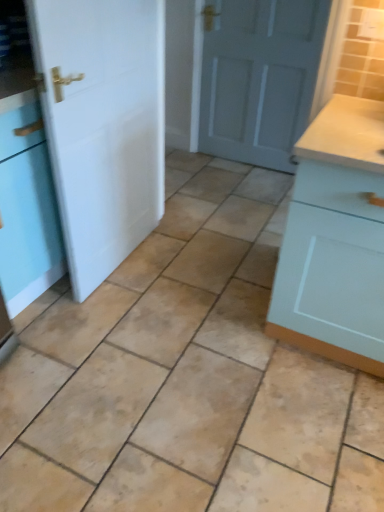
What do you see at coordinates (335, 240) in the screenshot?
I see `light blue wood cabinet at right` at bounding box center [335, 240].

What do you see at coordinates (259, 77) in the screenshot? Image resolution: width=384 pixels, height=512 pixels. I see `matte gray door at center, marked as the 2th door in a left-to-right arrangement` at bounding box center [259, 77].

Locate an element on the screen. The width and height of the screenshot is (384, 512). white matte door at left, acting as the second door starting from the back is located at coordinates (102, 125).

From the image's perspective, between beige ceramic tile at center and matte gray door at center, marked as the 2th door in a left-to-right arrangement, who is located below?

beige ceramic tile at center is shown below in the image.

Who is smaller, beige ceramic tile at center or matte gray door at center, the second door viewed from the front?

Smaller between the two is matte gray door at center, the second door viewed from the front.

The image size is (384, 512). I want to click on ceramic tile located on the left of matte gray door at center, marked as the 2th door in a left-to-right arrangement, so click(186, 375).

Can you tell me how much beige ceramic tile at center and matte gray door at center, the second door viewed from the front, differ in facing direction?

The facing directions of beige ceramic tile at center and matte gray door at center, the second door viewed from the front, are 90 degrees apart.

Which of these two, matte gray door at center, which appears as the first door when viewed from the back, or light blue wood cabinet at right, is smaller?

Smaller between the two is matte gray door at center, which appears as the first door when viewed from the back.

Measure the distance from matte gray door at center, which appears as the first door when viewed from the back, to light blue wood cabinet at right.

A distance of 4.97 feet exists between matte gray door at center, which appears as the first door when viewed from the back, and light blue wood cabinet at right.

Can you confirm if matte gray door at center, placed as the 1th door when sorted from right to left, is positioned to the right of light blue wood cabinet at right?

No, matte gray door at center, placed as the 1th door when sorted from right to left, is not to the right of light blue wood cabinet at right.

Which is in front, point (240, 67) or point (287, 311)?

Point (287, 311)

Looking at this image, considering the sizes of objects light blue wood cabinet at right and white matte door at left, which ranks as the 1th door in front-to-back order, in the image provided, who is taller, light blue wood cabinet at right or white matte door at left, which ranks as the 1th door in front-to-back order,?

white matte door at left, which ranks as the 1th door in front-to-back order, is taller.

Considering the relative positions of light blue wood cabinet at right and white matte door at left, which ranks as the 1th door in front-to-back order, in the image provided, is light blue wood cabinet at right to the left or to the right of white matte door at left, which ranks as the 1th door in front-to-back order,?

Clearly, light blue wood cabinet at right is on the right of white matte door at left, which ranks as the 1th door in front-to-back order, in the image.

The image size is (384, 512). I want to click on door that is the 1st one when counting backward from the light blue wood cabinet at right, so point(102,125).

From the image's perspective, is light blue wood cabinet at right located above or below white matte door at left, arranged as the first door when viewed from the left?

light blue wood cabinet at right is below white matte door at left, arranged as the first door when viewed from the left.

Does light blue wood cabinet at right touch matte gray door at center, the second door viewed from the front?

No, light blue wood cabinet at right is not with matte gray door at center, the second door viewed from the front.

Considering the sizes of objects light blue wood cabinet at right and matte gray door at center, placed as the 1th door when sorted from right to left, in the image provided, who is wider, light blue wood cabinet at right or matte gray door at center, placed as the 1th door when sorted from right to left,?

With larger width is light blue wood cabinet at right.

Can you confirm if light blue wood cabinet at right is positioned to the left of matte gray door at center, which appears as the first door when viewed from the back?

No, light blue wood cabinet at right is not to the left of matte gray door at center, which appears as the first door when viewed from the back.

Is light blue wood cabinet at right smaller than matte gray door at center, which appears as the first door when viewed from the back?

No, light blue wood cabinet at right is not smaller than matte gray door at center, which appears as the first door when viewed from the back.

Does matte gray door at center, the second door viewed from the front, come behind white matte door at left, which ranks as the second door in right-to-left order?

Yes, matte gray door at center, the second door viewed from the front, is further from the camera.

In the image, there is a matte gray door at center, the second door viewed from the front. At what (x,y) coordinates should I click in order to perform the action: click on door below it (from the image's perspective). Please return your answer as a coordinate pair (x, y). The image size is (384, 512). Looking at the image, I should click on (102, 125).

Choose the correct answer: Is matte gray door at center, placed as the 1th door when sorted from right to left, inside white matte door at left, which ranks as the second door in right-to-left order, or outside it?

matte gray door at center, placed as the 1th door when sorted from right to left, cannot be found inside white matte door at left, which ranks as the second door in right-to-left order.

Between point (222, 4) and point (77, 93), which one is positioned in front?

Point (77, 93)

In order to click on door that is the 1st one when counting upward from the beige ceramic tile at center (from the image's perspective) in this screenshot , I will do `click(102, 125)`.

From the image's perspective, is beige ceramic tile at center beneath white matte door at left, acting as the second door starting from the back?

Yes, from the image's perspective, beige ceramic tile at center is beneath white matte door at left, acting as the second door starting from the back.

Which is more to the left, beige ceramic tile at center or white matte door at left, which ranks as the second door in right-to-left order?

From the viewer's perspective, white matte door at left, which ranks as the second door in right-to-left order, appears more on the left side.

Is beige ceramic tile at center taller than white matte door at left, acting as the second door starting from the back?

No.

Is white matte door at left, which ranks as the 1th door in front-to-back order, turned away from beige ceramic tile at center?

No, white matte door at left, which ranks as the 1th door in front-to-back order, is not facing the opposite direction of beige ceramic tile at center.

How many degrees apart are the facing directions of white matte door at left, which ranks as the 1th door in front-to-back order, and beige ceramic tile at center?

179 degrees separate the facing orientations of white matte door at left, which ranks as the 1th door in front-to-back order, and beige ceramic tile at center.

From a real-world perspective, which object rests below the other?

beige ceramic tile at center is physically lower.

Considering the points (65, 14) and (365, 490), which point is in front, point (65, 14) or point (365, 490)?

The point (65, 14) is closer.

What are the coordinates of `the 2nd door behind when counting from the beige ceramic tile at center` in the screenshot? It's located at (259, 77).

Locate an element on the screen. cabinetry below the matte gray door at center, placed as the 1th door when sorted from right to left (from a real-world perspective) is located at coordinates (335, 240).

Estimate the real-world distances between objects in this image. Which object is further from matte gray door at center, which appears as the first door when viewed from the back, beige ceramic tile at center or white matte door at left, arranged as the first door when viewed from the left?

beige ceramic tile at center lies further to matte gray door at center, which appears as the first door when viewed from the back, than the other object.

Based on their spatial positions, is beige ceramic tile at center or matte gray door at center, the second door viewed from the front, closer to light blue wood cabinet at right?

beige ceramic tile at center is positioned closer to the anchor light blue wood cabinet at right.

Which object lies further to the anchor point white matte door at left, which ranks as the second door in right-to-left order, matte gray door at center, marked as the 2th door in a left-to-right arrangement, or beige ceramic tile at center?

Among the two, matte gray door at center, marked as the 2th door in a left-to-right arrangement, is located further to white matte door at left, which ranks as the second door in right-to-left order.

Estimate the real-world distances between objects in this image. Which object is further from beige ceramic tile at center, white matte door at left, acting as the second door starting from the back, or light blue wood cabinet at right?

Among the two, white matte door at left, acting as the second door starting from the back, is located further to beige ceramic tile at center.

Based on their spatial positions, is beige ceramic tile at center or white matte door at left, which ranks as the second door in right-to-left order, further from light blue wood cabinet at right?

white matte door at left, which ranks as the second door in right-to-left order, is further to light blue wood cabinet at right.

When comparing their distances from light blue wood cabinet at right, does matte gray door at center, the second door viewed from the front, or beige ceramic tile at center seem closer?

beige ceramic tile at center is closer to light blue wood cabinet at right.

From the image, which object appears to be farther from matte gray door at center, the second door viewed from the front, white matte door at left, which ranks as the second door in right-to-left order, or light blue wood cabinet at right?

Among the two, light blue wood cabinet at right is located further to matte gray door at center, the second door viewed from the front.

Which object lies nearer to the anchor point light blue wood cabinet at right, white matte door at left, arranged as the first door when viewed from the left, or matte gray door at center, which appears as the first door when viewed from the back?

white matte door at left, arranged as the first door when viewed from the left, is closer to light blue wood cabinet at right.

Find the location of a particular element. The image size is (384, 512). cabinetry between beige ceramic tile at center and matte gray door at center, the second door viewed from the front, in the front-back direction is located at coordinates (335, 240).

Identify the location of door between beige ceramic tile at center and matte gray door at center, the second door viewed from the front, along the z-axis. This screenshot has height=512, width=384. (102, 125).

You are a GUI agent. You are given a task and a screenshot of the screen. Output one action in this format:
    pyautogui.click(x=<x>, y=<y>)
    Task: Click on the door located between light blue wood cabinet at right and matte gray door at center, the second door viewed from the front, in the depth direction
    This screenshot has height=512, width=384.
    Given the screenshot: What is the action you would take?
    pyautogui.click(x=102, y=125)

Locate an element on the screen. The image size is (384, 512). ceramic tile situated between white matte door at left, which ranks as the 1th door in front-to-back order, and light blue wood cabinet at right from left to right is located at coordinates (186, 375).